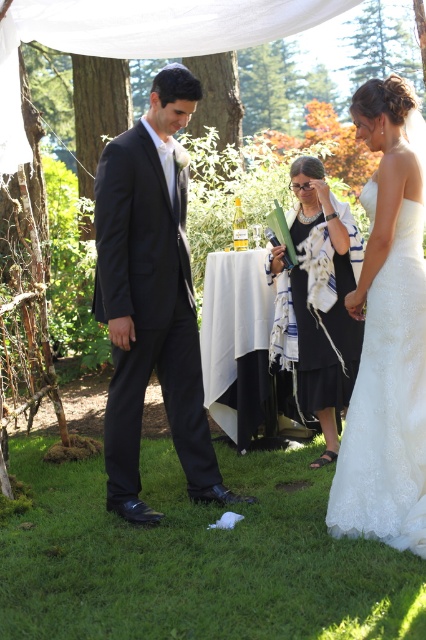
Question: Observing the image, what is the correct spatial positioning of shiny black suit at center in reference to white lace dress at right?

Choices:
 (A) right
 (B) left

Answer: (B)

Question: Can you confirm if matte black suit at center is smaller than white textured shawl at center?

Choices:
 (A) no
 (B) yes

Answer: (A)

Question: Which point is closer to the camera taking this photo?

Choices:
 (A) (414, 381)
 (B) (317, 387)
 (C) (345, 497)
 (D) (164, 320)

Answer: (A)

Question: Which of the following is the closest to the observer?

Choices:
 (A) white textured shawl at center
 (B) matte black suit at center

Answer: (B)

Question: Can you confirm if matte black suit at center is positioned below white lace dress at right?

Choices:
 (A) no
 (B) yes

Answer: (B)

Question: Which point is farther from the camera taking this photo?

Choices:
 (A) (422, 417)
 (B) (342, 374)
 (C) (380, 364)
 (D) (132, 243)

Answer: (B)